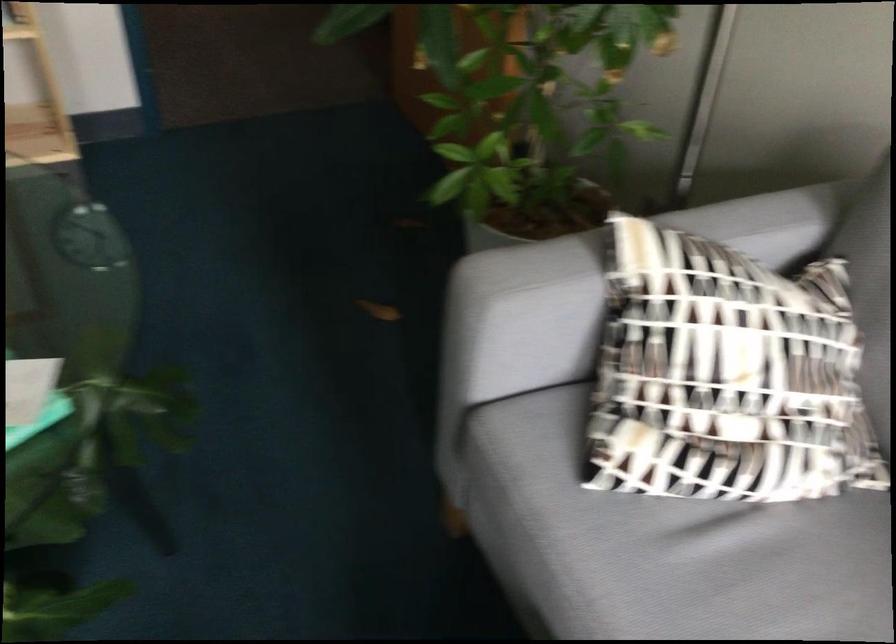
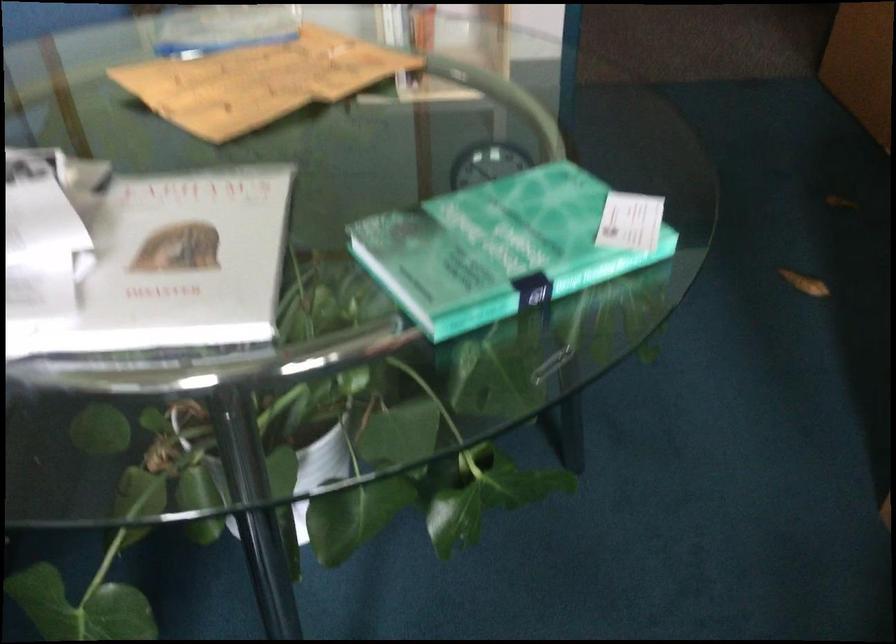
Question: Which direction would the cameraman need to move to produce the second image? Reply with the corresponding letter.

Choices:
 (A) Left
 (B) Right
 (C) Forward
 (D) Backward

Answer: (A)